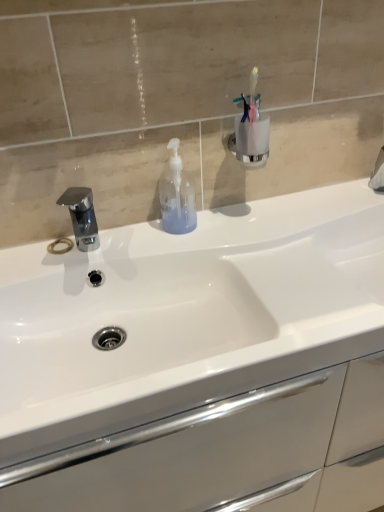
Find the location of `free point to the left of translucent plastic soap dispenser at center`. free point to the left of translucent plastic soap dispenser at center is located at coordinates (120, 241).